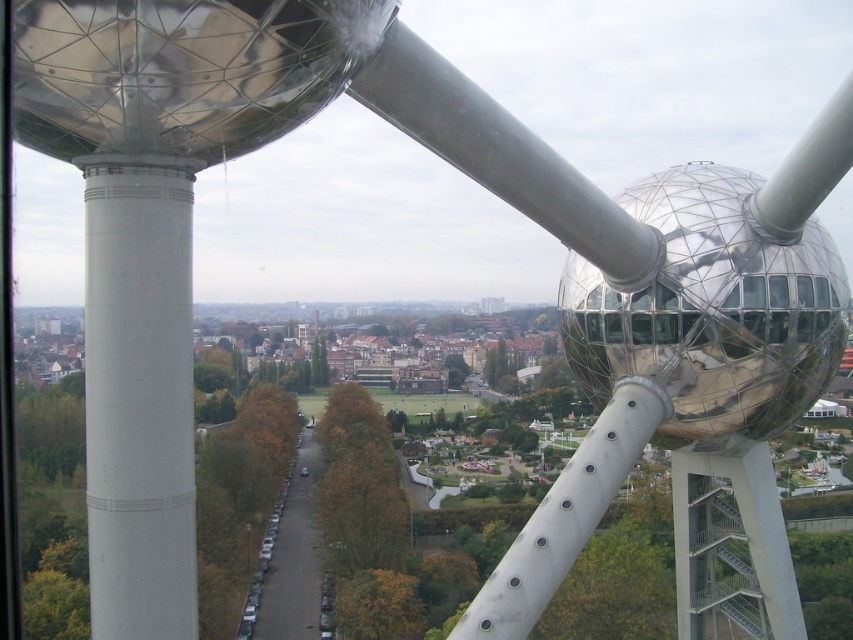
You are standing at the observation deck and want to take a photo of both the point at coordinates point (117,381) and point (555,529). Which point should you focus on first to ensure both are in clear view?

You should focus on point (117,381) first because it is closer to you than point (555,529), ensuring both are in clear view.

You are standing at the observation deck and see two points marked in the scene. Which point is closer to you, point (838, 312) or point (657, 417)?

Point (657, 417) is closer to you because it is less further to the camera than point (838, 312).

You are an architect visiting the city and want to compare the two structures in the scene. Which one is shorter between the polished metallic sphere at right and the white smooth pillar at left?

The polished metallic sphere at right has a lesser height compared to the white smooth pillar at left, so the polished metallic sphere at right is shorter.